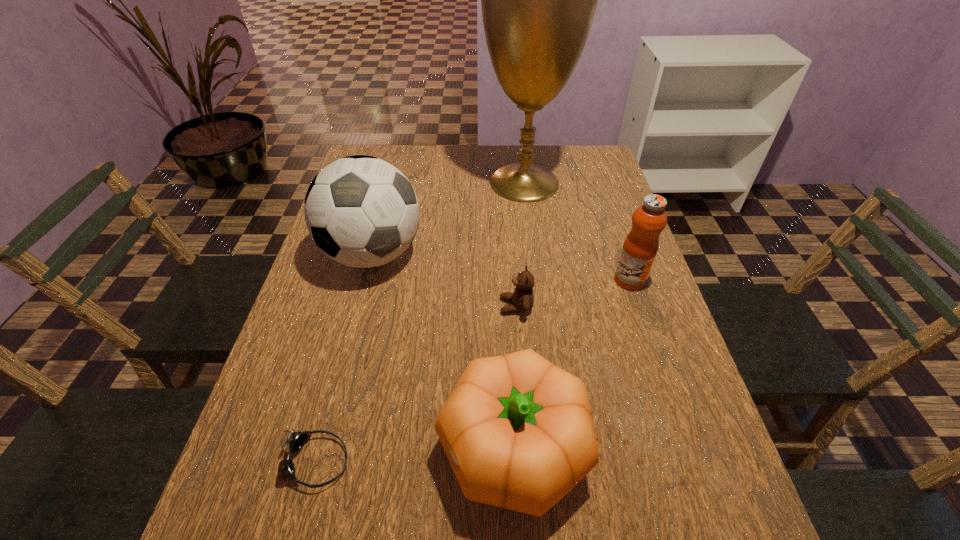
Identify the location of the farthest object. (538, 0).

Image resolution: width=960 pixels, height=540 pixels. I want to click on trophy cup, so click(x=538, y=0).

Locate an element on the screen. soccer ball is located at coordinates (362, 212).

Identify the location of the rightmost object. The width and height of the screenshot is (960, 540). (640, 247).

The width and height of the screenshot is (960, 540). Find the location of `pumpkin`. pumpkin is located at coordinates (518, 431).

Identify the location of the second shortest object. (522, 299).

This screenshot has width=960, height=540. Identify the location of the shortest object. (295, 441).

Find the location of a particular element. vacant region located 0.150m on the left of the trophy cup is located at coordinates (434, 183).

Image resolution: width=960 pixels, height=540 pixels. Find the location of `vacant area situated on the main logo of the soccer ball`. vacant area situated on the main logo of the soccer ball is located at coordinates (340, 381).

At what (x,y) coordinates should I click in order to perform the action: click on free space located on the front label of the rightmost object. Please return your answer as a coordinate pair (x, y). This screenshot has width=960, height=540. Looking at the image, I should click on (667, 390).